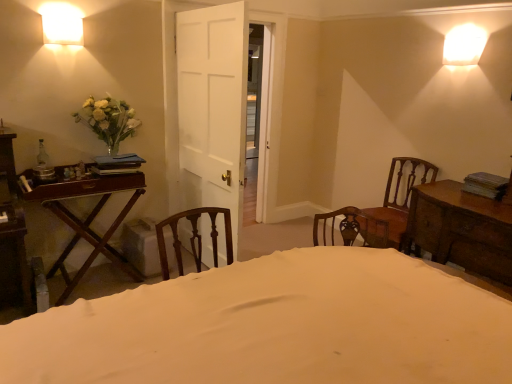
Question: From a real-world perspective, is mahogany wood table at left, the 1th table when ordered from left to right, located higher than white fabric bed at center?

Choices:
 (A) no
 (B) yes

Answer: (B)

Question: Is white fabric bed at center completely or partially inside mahogany wood table at left, the 1th table when ordered from left to right?

Choices:
 (A) yes
 (B) no

Answer: (B)

Question: From the image's perspective, is mahogany wood table at left, the 1th table when ordered from left to right, located beneath white fabric bed at center?

Choices:
 (A) yes
 (B) no

Answer: (B)

Question: Does mahogany wood table at left, the second table from the right, come behind white fabric bed at center?

Choices:
 (A) no
 (B) yes

Answer: (B)

Question: Is mahogany wood table at left, the 1th table when ordered from left to right, in front of white fabric bed at center?

Choices:
 (A) yes
 (B) no

Answer: (B)

Question: Can you confirm if mahogany wood table at left, the second table from the right, is taller than white fabric bed at center?

Choices:
 (A) no
 (B) yes

Answer: (B)

Question: Is white glossy wall sconce at upper left facing towards wooden chair at right?

Choices:
 (A) yes
 (B) no

Answer: (B)

Question: From a real-world perspective, is white glossy wall sconce at upper left physically below wooden chair at right?

Choices:
 (A) no
 (B) yes

Answer: (A)

Question: Considering the relative sizes of white glossy wall sconce at upper left and wooden chair at right in the image provided, is white glossy wall sconce at upper left smaller than wooden chair at right?

Choices:
 (A) no
 (B) yes

Answer: (B)

Question: Would you say wooden chair at right is part of white glossy wall sconce at upper left's contents?

Choices:
 (A) yes
 (B) no

Answer: (B)

Question: Does white glossy wall sconce at upper left appear on the right side of wooden chair at right?

Choices:
 (A) no
 (B) yes

Answer: (A)

Question: Is white glossy wall sconce at upper left positioned before wooden chair at right?

Choices:
 (A) no
 (B) yes

Answer: (B)

Question: Considering the relative sizes of wooden chair at right and mahogany wood table at left, the 1th table when ordered from left to right, in the image provided, is wooden chair at right smaller than mahogany wood table at left, the 1th table when ordered from left to right,?

Choices:
 (A) yes
 (B) no

Answer: (A)